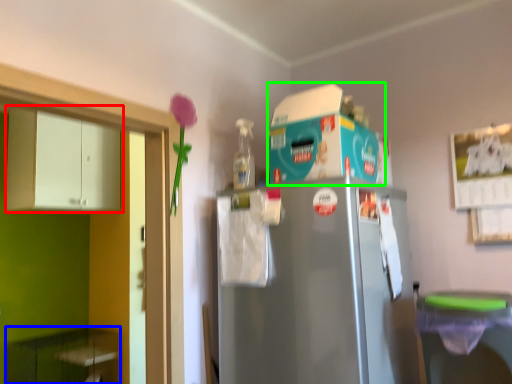
Question: Estimate the real-world distances between objects in this image. Which object is closer to cabinetry (highlighted by a red box), cabinetry (highlighted by a blue box) or appliance (highlighted by a green box)?

Choices:
 (A) cabinetry
 (B) appliance

Answer: (A)